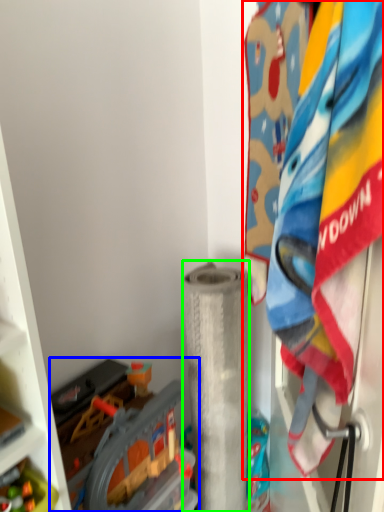
Question: Which object is positioned farthest from laundry (highlighted by a red box)? Select from toy (highlighted by a blue box) and toilet paper (highlighted by a green box).

Choices:
 (A) toy
 (B) toilet paper

Answer: (B)